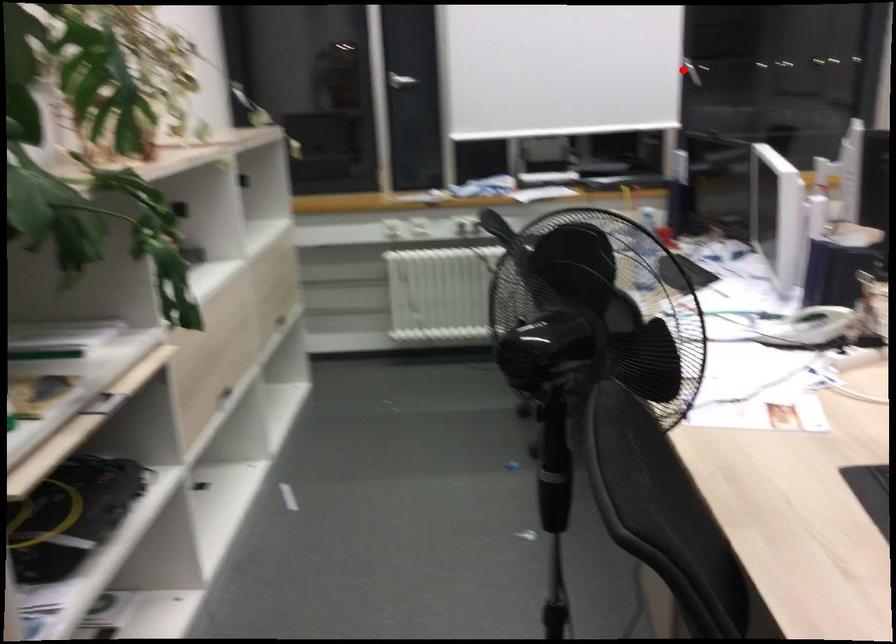
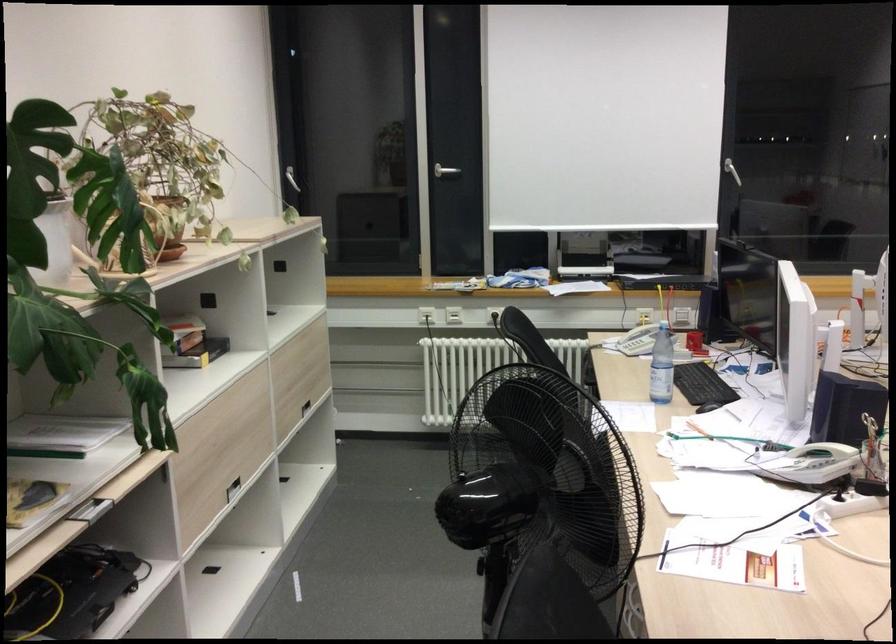
Where in the second image is the point corresponding to the highlighted location from the first image?

(731, 171)